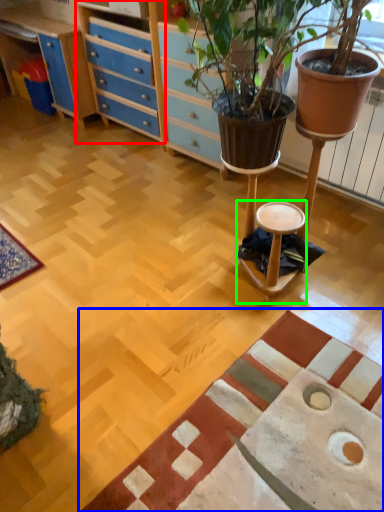
Question: Based on their relative distances, which object is nearer to file cabinet (highlighted by a red box)? Choose from mat (highlighted by a blue box) and stool (highlighted by a green box).

Choices:
 (A) mat
 (B) stool

Answer: (B)